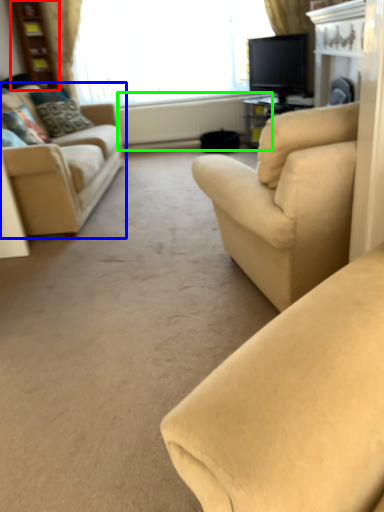
Question: Which object is the farthest from bookshelf (highlighted by a red box)? Choose among these: studio couch (highlighted by a blue box) or radiator (highlighted by a green box).

Choices:
 (A) studio couch
 (B) radiator

Answer: (A)